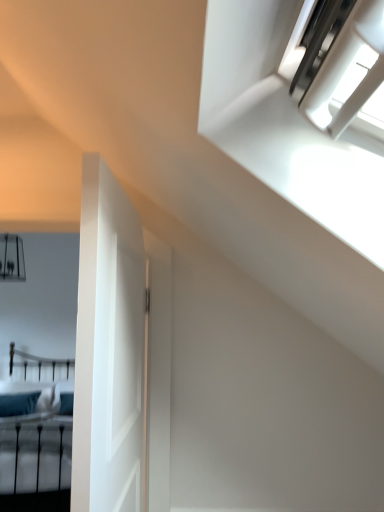
Measure the distance between point (5,446) and camera.

Point (5,446) and camera are 11.18 feet apart.

I want to click on teal fabric pillow at lower left, so click(18, 404).

Is teal fabric bed at lower left aimed at white matte door at left?

Yes, teal fabric bed at lower left is turned towards white matte door at left.

Is teal fabric bed at lower left completely or partially outside of white matte door at left?

teal fabric bed at lower left lies outside white matte door at left's area.

Who is bigger, teal fabric bed at lower left or white matte door at left?

Bigger between the two is teal fabric bed at lower left.

Considering the sizes of teal fabric pillow at lower left and teal fabric bed at lower left in the image, is teal fabric pillow at lower left bigger or smaller than teal fabric bed at lower left?

Considering their sizes, teal fabric pillow at lower left takes up less space than teal fabric bed at lower left.

Does teal fabric pillow at lower left have a lesser width compared to teal fabric bed at lower left?

Yes.

Is teal fabric pillow at lower left facing away from teal fabric bed at lower left?

Yes.

Can you tell me how much teal fabric pillow at lower left and teal fabric bed at lower left differ in facing direction?

There is a 4.31-degree angle between the facing directions of teal fabric pillow at lower left and teal fabric bed at lower left.

Which is closer to the camera, (x=115, y=296) or (x=19, y=456)?

Point (x=115, y=296)

From the image's perspective, is white matte door at left located above or below teal fabric bed at lower left?

white matte door at left is above teal fabric bed at lower left.

What's the angular difference between white matte door at left and teal fabric bed at lower left's facing directions?

They differ by 95.7 degrees in their facing directions.

Is white matte door at left in contact with teal fabric bed at lower left?

white matte door at left and teal fabric bed at lower left are not in contact.

Is white matte door at left wider than teal fabric pillow at lower left?

Incorrect, the width of white matte door at left does not surpass that of teal fabric pillow at lower left.

Choose the correct answer: Is white matte door at left inside teal fabric pillow at lower left or outside it?

white matte door at left lies outside teal fabric pillow at lower left.

Can you confirm if white matte door at left is shorter than teal fabric pillow at lower left?

No, white matte door at left is not shorter than teal fabric pillow at lower left.

Does point (94, 199) appear closer or farther from the camera than point (8, 410)?

Point (94, 199).

How different are the orientations of teal fabric bed at lower left and teal fabric pillow at lower left in degrees?

They differ by 4.31 degrees in their facing directions.

Does point (19, 485) appear closer or farther from the camera than point (9, 404)?

Point (19, 485).

Is teal fabric bed at lower left thinner than teal fabric pillow at lower left?

No.

From the image's perspective, does teal fabric bed at lower left appear lower than teal fabric pillow at lower left?

Correct, teal fabric bed at lower left appears lower than teal fabric pillow at lower left in the image.

Between teal fabric pillow at lower left and white matte door at left, which one appears on the right side from the viewer's perspective?

white matte door at left is more to the right.

Is white matte door at left at the back of teal fabric pillow at lower left?

That's not correct — teal fabric pillow at lower left is not looking away from white matte door at left.

Identify the location of door above the teal fabric pillow at lower left (from a real-world perspective). This screenshot has width=384, height=512. (105, 350).

Is point (18, 404) closer or farther from the camera than point (133, 411)?

Clearly, point (18, 404) is more distant from the camera than point (133, 411).

I want to click on bed below the white matte door at left (from a real-world perspective), so [36, 436].

Locate an element on the screen. This screenshot has height=512, width=384. pillow behind the teal fabric bed at lower left is located at coordinates (18, 404).

From the image, which object appears to be farther from white matte door at left, teal fabric pillow at lower left or teal fabric bed at lower left?

teal fabric pillow at lower left is further to white matte door at left.

Which object lies further to the anchor point teal fabric pillow at lower left, teal fabric bed at lower left or white matte door at left?

Based on the image, white matte door at left appears to be further to teal fabric pillow at lower left.

Looking at the image, which one is located further to white matte door at left, teal fabric bed at lower left or teal fabric pillow at lower left?

Based on the image, teal fabric pillow at lower left appears to be further to white matte door at left.

Considering their positions, is teal fabric pillow at lower left positioned further to teal fabric bed at lower left than white matte door at left?

white matte door at left is positioned further to the anchor teal fabric bed at lower left.

Which object lies further to the anchor point teal fabric bed at lower left, white matte door at left or teal fabric pillow at lower left?

The object further to teal fabric bed at lower left is white matte door at left.

Which object lies nearer to the anchor point teal fabric pillow at lower left, white matte door at left or teal fabric bed at lower left?

teal fabric bed at lower left lies closer to teal fabric pillow at lower left than the other object.

I want to click on bed between white matte door at left and teal fabric pillow at lower left from front to back, so click(36, 436).